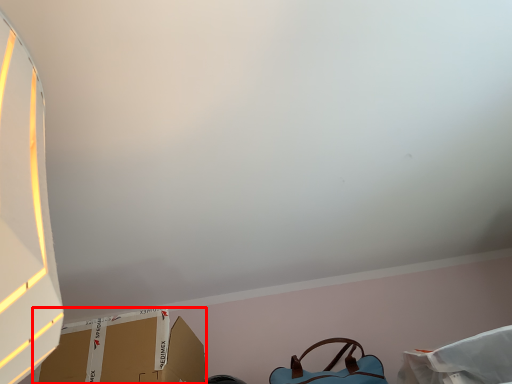
Question: From the image's perspective, what is the correct spatial relationship of cardboard box (annotated by the red box) in relation to handbag?

Choices:
 (A) above
 (B) below

Answer: (A)